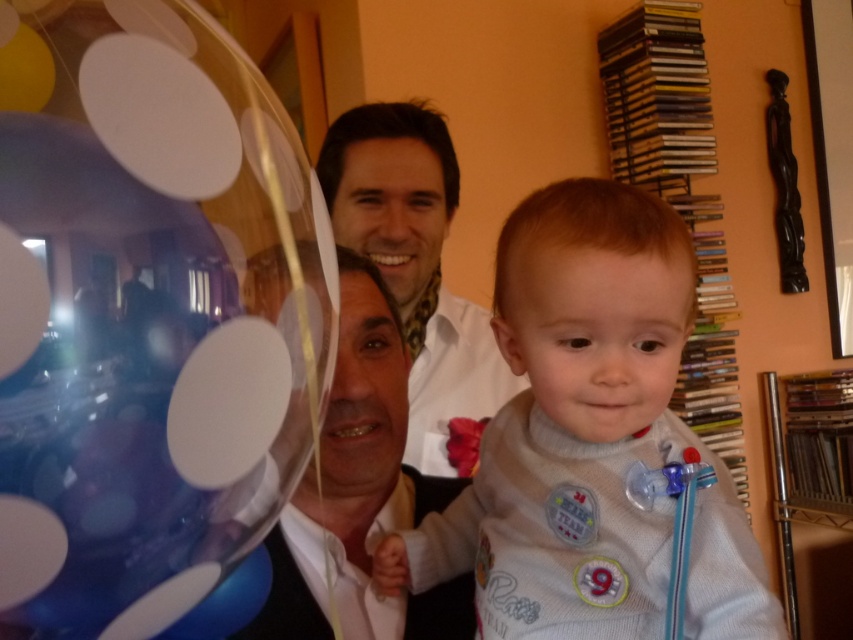
Measure the distance from white soft baby at center to white glossy shirt at upper center.

white soft baby at center and white glossy shirt at upper center are 24.66 inches apart.

Who is more forward, [560,604] or [440,372]?

Positioned in front is point [560,604].

This screenshot has height=640, width=853. Find the location of `white soft baby at center`. white soft baby at center is located at coordinates (589, 442).

Between white glossy shirt at upper center and matte black shirt at center, which one has more height?

Standing taller between the two is white glossy shirt at upper center.

Is the position of white glossy shirt at upper center more distant than that of matte black shirt at center?

Yes, it is.

Measure the distance between white glossy shirt at upper center and camera.

The distance of white glossy shirt at upper center from camera is 4.01 feet.

The height and width of the screenshot is (640, 853). What are the coordinates of `white glossy shirt at upper center` in the screenshot? It's located at (415, 260).

Can you confirm if transparent plastic balloon at upper left is bigger than white glossy shirt at upper center?

No, transparent plastic balloon at upper left is not bigger than white glossy shirt at upper center.

Can you confirm if transparent plastic balloon at upper left is taller than white glossy shirt at upper center?

Incorrect, transparent plastic balloon at upper left's height is not larger of white glossy shirt at upper center's.

Where is `transparent plastic balloon at upper left`? This screenshot has width=853, height=640. transparent plastic balloon at upper left is located at coordinates (148, 317).